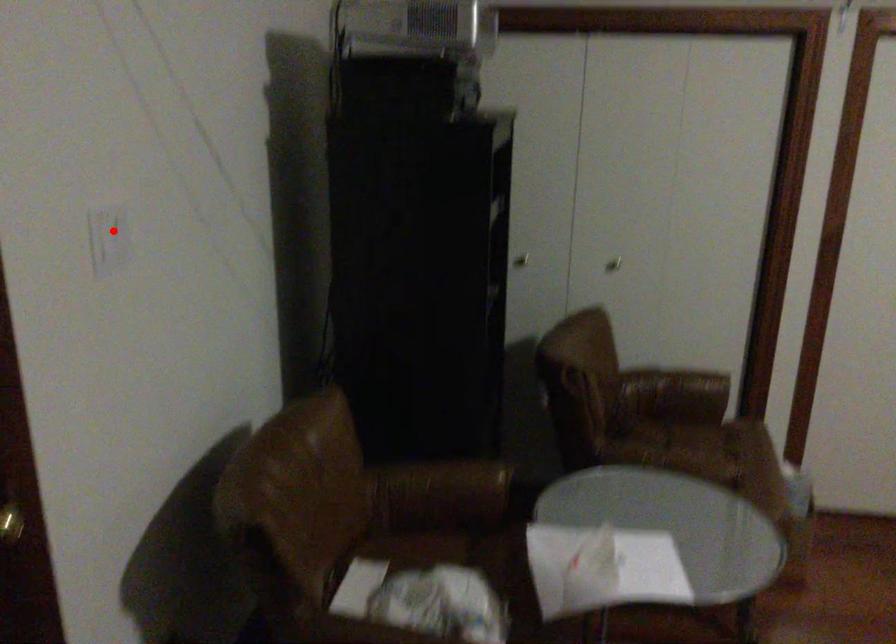
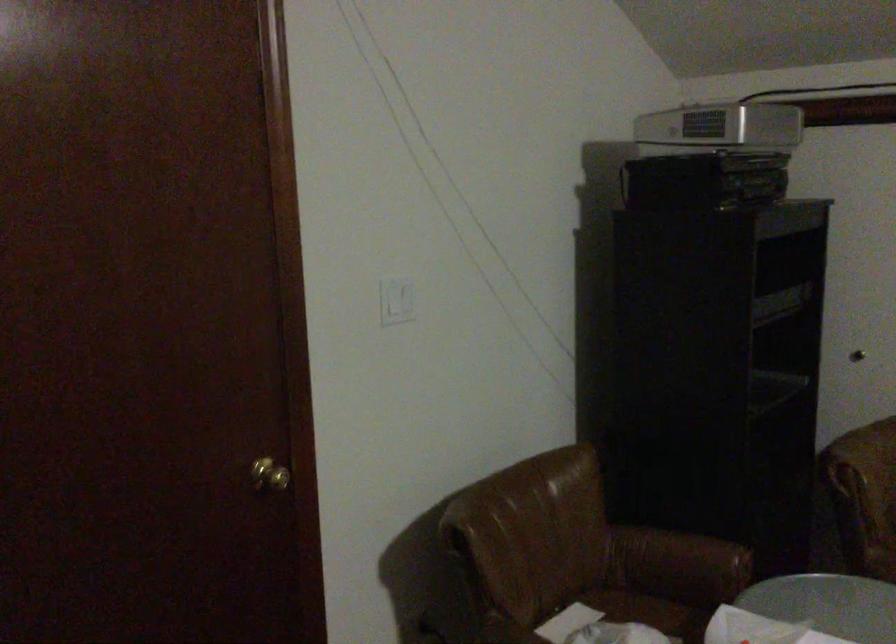
The point at the highlighted location is marked in the first image. Where is the corresponding point in the second image?

(397, 301)